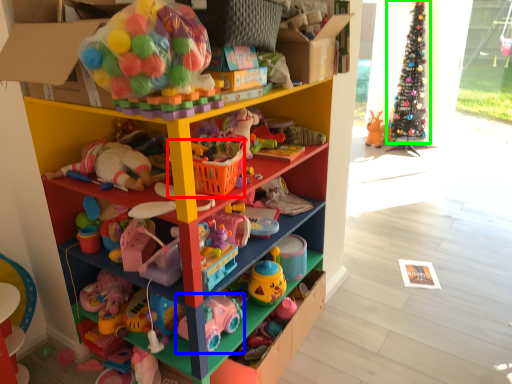
Question: Estimate the real-world distances between objects in this image. Which object is closer to basket (highlighted by a red box), toy (highlighted by a blue box) or christmas tree (highlighted by a green box)?

Choices:
 (A) toy
 (B) christmas tree

Answer: (A)